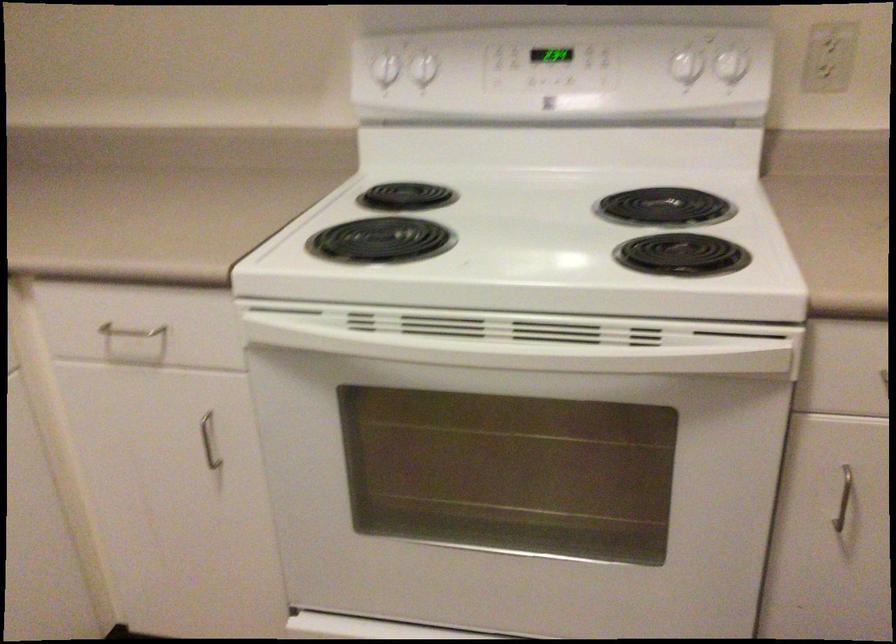
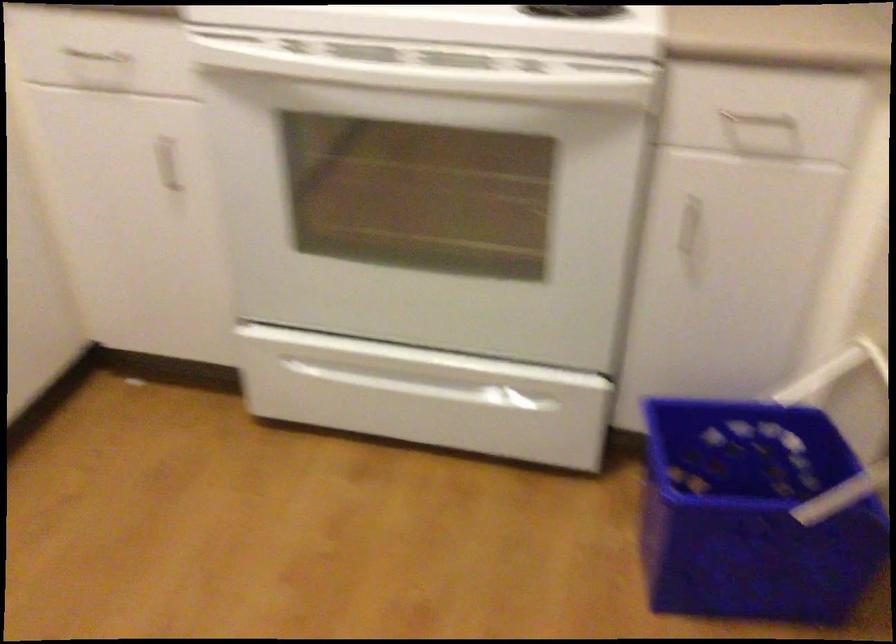
In the second image, find the point that corresponds to pixel 202 428 in the first image.

(167, 164)